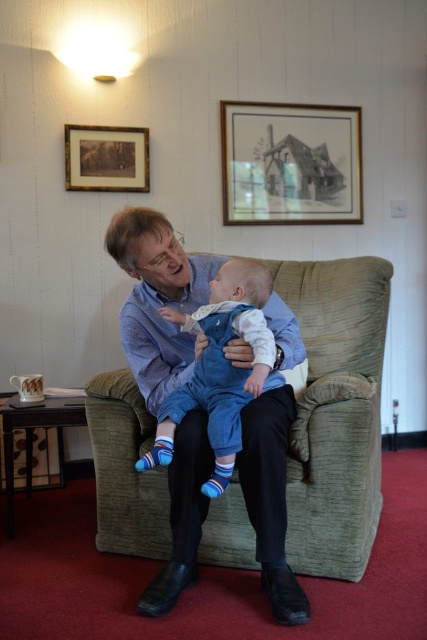
Does point (271, 442) lie behind point (146, 134)?

No, it is in front of (146, 134).

Does matte blue shirt at center have a larger size compared to wooden picture frame at upper left?

Correct, matte blue shirt at center is larger in size than wooden picture frame at upper left.

Is point (280, 337) farther from camera compared to point (96, 176)?

No, (280, 337) is in front of (96, 176).

This screenshot has height=640, width=427. Find the location of `matte blue shirt at center`. matte blue shirt at center is located at coordinates (157, 300).

Between matte blue shirt at center and black matte picture frame at upper center, which one is positioned lower?

matte blue shirt at center is below.

Between matte blue shirt at center and black matte picture frame at upper center, which one appears on the right side from the viewer's perspective?

From the viewer's perspective, black matte picture frame at upper center appears more on the right side.

This screenshot has width=427, height=640. What do you see at coordinates (157, 300) in the screenshot?
I see `matte blue shirt at center` at bounding box center [157, 300].

Identify the location of matte blue shirt at center. (157, 300).

Between black matte picture frame at upper center and blue denim overalls at center, which one has less height?

black matte picture frame at upper center

Can you confirm if black matte picture frame at upper center is taller than blue denim overalls at center?

Incorrect, black matte picture frame at upper center's height is not larger of blue denim overalls at center's.

Measure the distance between point (227, 100) and camera.

They are 3.12 meters apart.

You are a GUI agent. You are given a task and a screenshot of the screen. Output one action in this format:
    pyautogui.click(x=<x>, y=<y>)
    Task: Click on the black matte picture frame at upper center
    
    Given the screenshot: What is the action you would take?
    click(x=289, y=163)